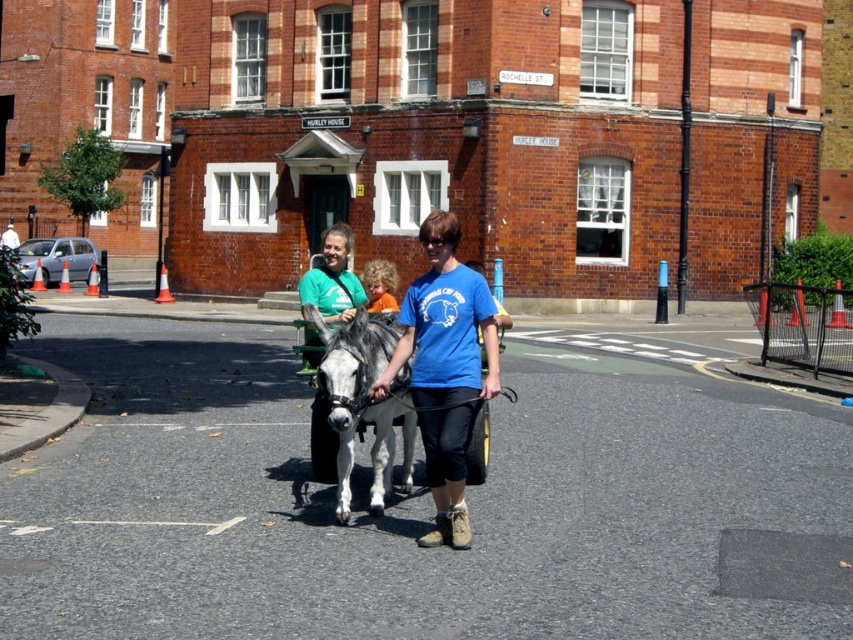
Question: Which of the following is the closest to the observer?

Choices:
 (A) gray metallic cart at center
 (B) gray matte mule at center
 (C) matte green t-shirt at center

Answer: (B)

Question: Which of the following is the closest to the observer?

Choices:
 (A) matte green t-shirt at center
 (B) curly blonde hair at center

Answer: (A)

Question: Does gray metallic cart at center have a smaller size compared to curly blonde hair at center?

Choices:
 (A) yes
 (B) no

Answer: (A)

Question: Estimate the real-world distances between objects in this image. Which object is closer to the blue cotton shirt at center?

Choices:
 (A) matte green t-shirt at center
 (B) curly blonde hair at center

Answer: (B)

Question: In this image, where is gray matte mule at center located relative to curly blonde hair at center?

Choices:
 (A) below
 (B) above

Answer: (A)

Question: Can you confirm if blue cotton shirt at center is positioned above gray metallic cart at center?

Choices:
 (A) no
 (B) yes

Answer: (B)